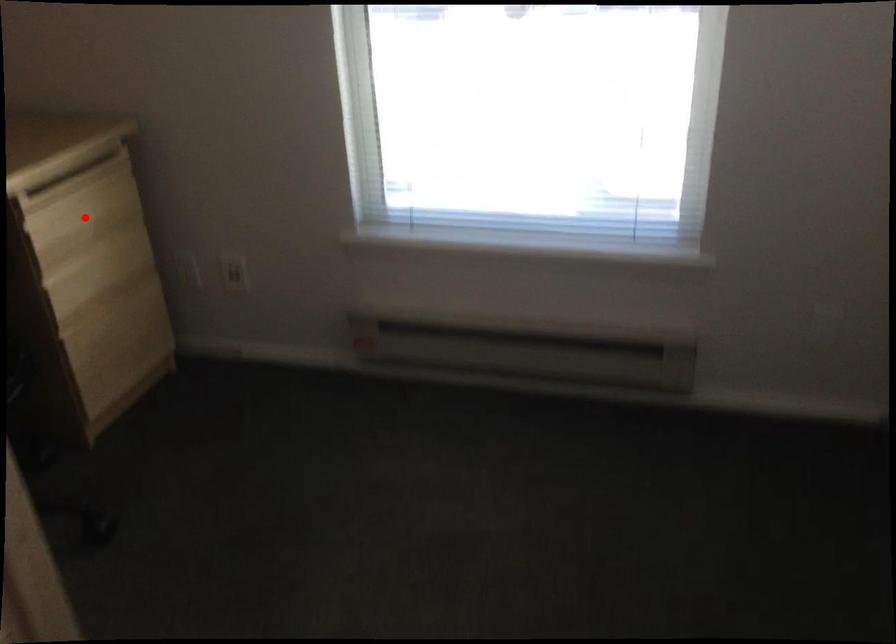
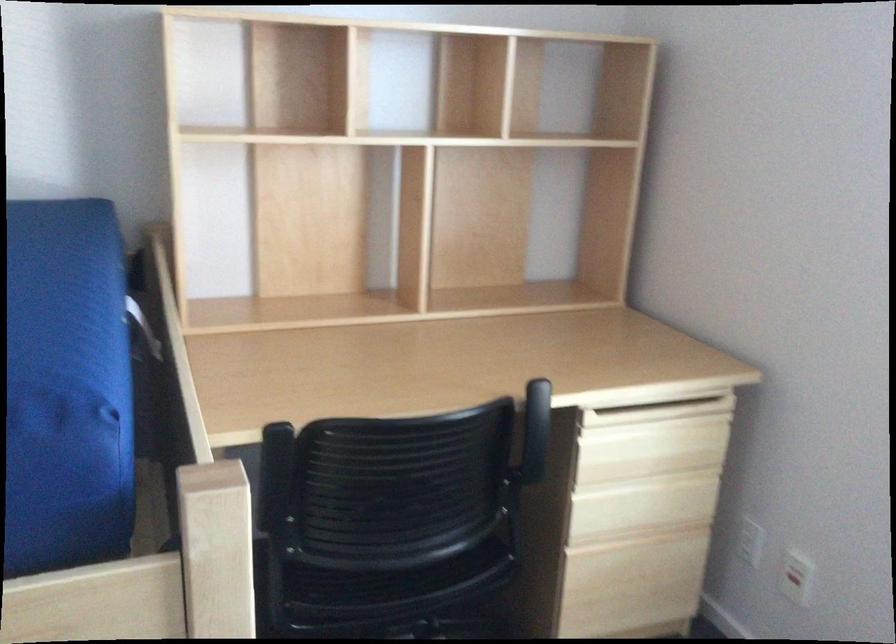
Locate, in the second image, the point that corresponds to the highlighted location in the first image.

(650, 448)